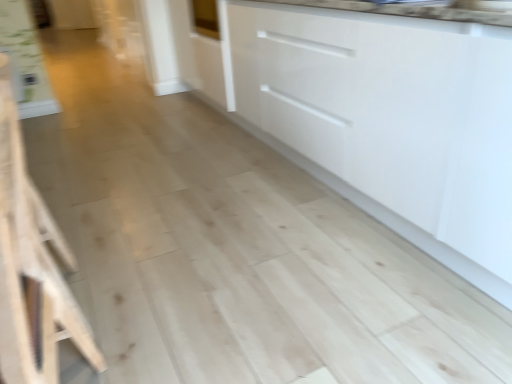
Question: Should I look upward or downward to see white glossy cabinet at center?

Choices:
 (A) up
 (B) down

Answer: (A)

Question: Is white glossy cabinet at center at the back of light wood stool at left?

Choices:
 (A) yes
 (B) no

Answer: (A)

Question: Is light wood stool at left facing towards white glossy cabinet at center?

Choices:
 (A) yes
 (B) no

Answer: (B)

Question: From a real-world perspective, is light wood stool at left physically above white glossy cabinet at center?

Choices:
 (A) no
 (B) yes

Answer: (A)

Question: Does light wood stool at left have a greater width compared to white glossy cabinet at center?

Choices:
 (A) yes
 (B) no

Answer: (B)

Question: Is light wood stool at left outside of white glossy cabinet at center?

Choices:
 (A) no
 (B) yes

Answer: (B)

Question: From a real-world perspective, is light wood stool at left physically below white glossy cabinet at center?

Choices:
 (A) yes
 (B) no

Answer: (A)

Question: Is white glossy cabinet at center outside light wood stool at left?

Choices:
 (A) yes
 (B) no

Answer: (A)

Question: Is white glossy cabinet at center wider than light wood stool at left?

Choices:
 (A) yes
 (B) no

Answer: (A)

Question: From a real-world perspective, is white glossy cabinet at center under light wood stool at left?

Choices:
 (A) yes
 (B) no

Answer: (B)

Question: Does white glossy cabinet at center appear on the right side of light wood stool at left?

Choices:
 (A) no
 (B) yes

Answer: (B)

Question: Can you confirm if white glossy cabinet at center is smaller than light wood stool at left?

Choices:
 (A) no
 (B) yes

Answer: (A)

Question: Does white glossy cabinet at center turn towards light wood stool at left?

Choices:
 (A) yes
 (B) no

Answer: (A)

Question: Is point (273, 122) positioned closer to the camera than point (40, 359)?

Choices:
 (A) farther
 (B) closer

Answer: (A)